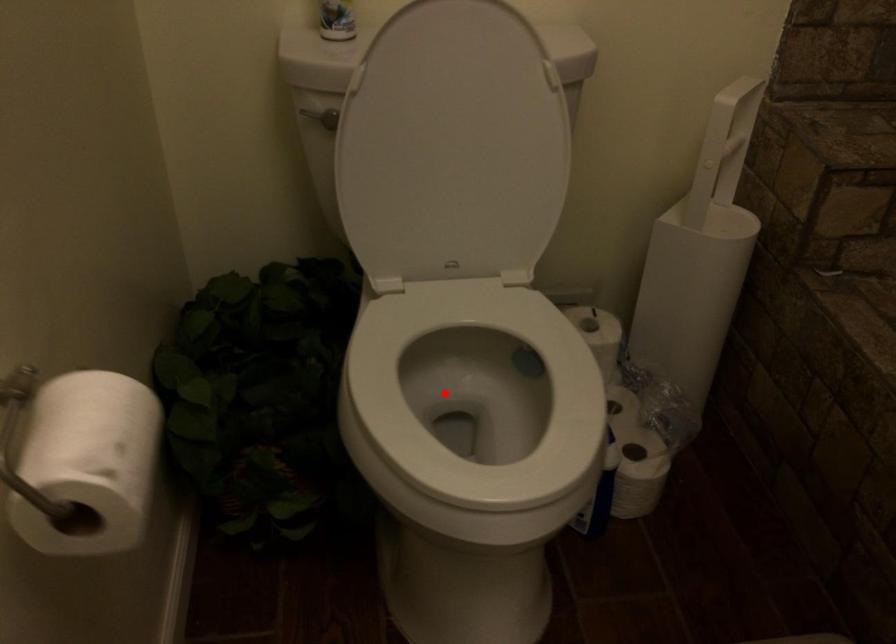
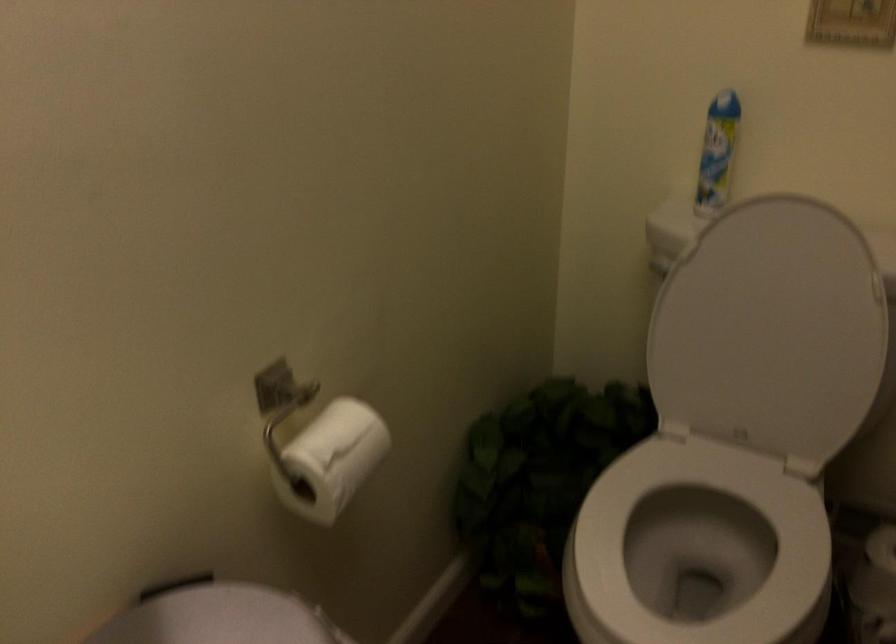
The point at the highlighted location is marked in the first image. Where is the corresponding point in the second image?

(698, 547)